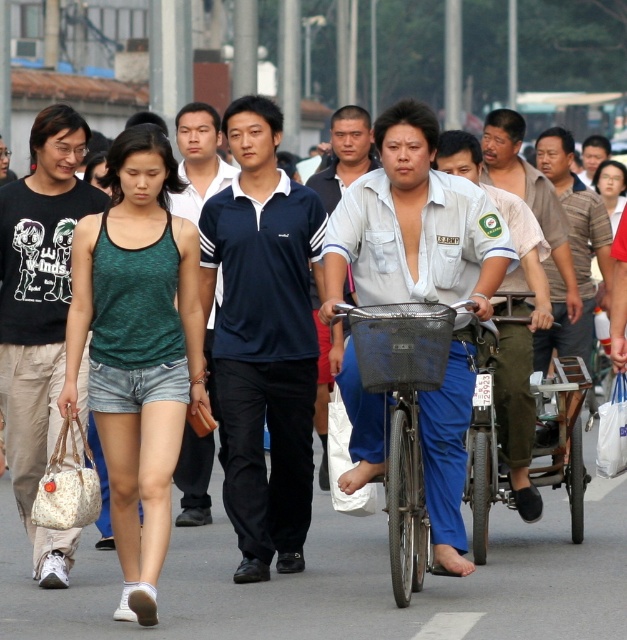
You are a pedestrian trying to cross the street. There is a metallic silver cart at lower right and light blue denim pants at center. Which object is closer to you?

The metallic silver cart at lower right is positioned under light blue denim pants at center, meaning it is closer to you.

You are a delivery person needing to pass through a narrow alleyway that can only accommodate objects up to the width of the light blue denim pants at center. Can the metallic silver cart at lower right fit through this alleyway?

The metallic silver cart at lower right might be wider than light blue denim pants at center, so it may not fit through the alleyway.

You are standing at point (324,348) and want to walk to point (482,506). Is the destination point in front of or behind you?

The destination point (482,506) is in front of point (324,348), so it is in front of you.